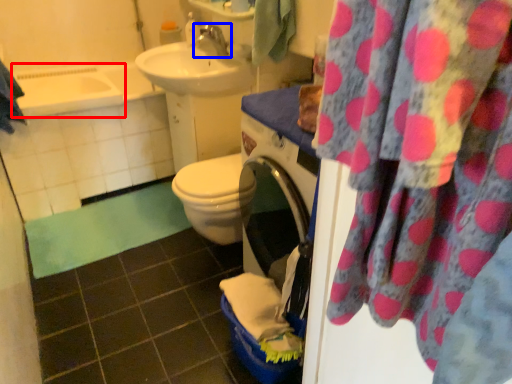
Question: Which object is further to the camera taking this photo, bath (highlighted by a red box) or tap (highlighted by a blue box)?

Choices:
 (A) bath
 (B) tap

Answer: (A)